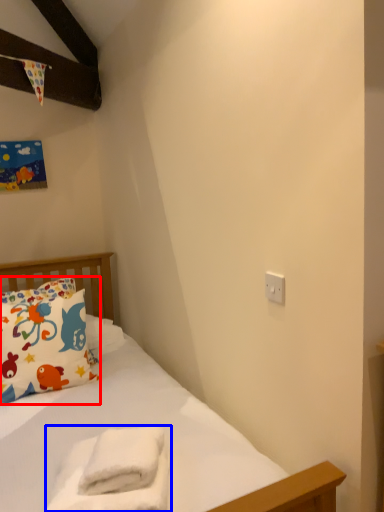
Question: Which object appears closest to the camera in this image, pillow (highlighted by a red box) or material (highlighted by a blue box)?

Choices:
 (A) pillow
 (B) material

Answer: (B)